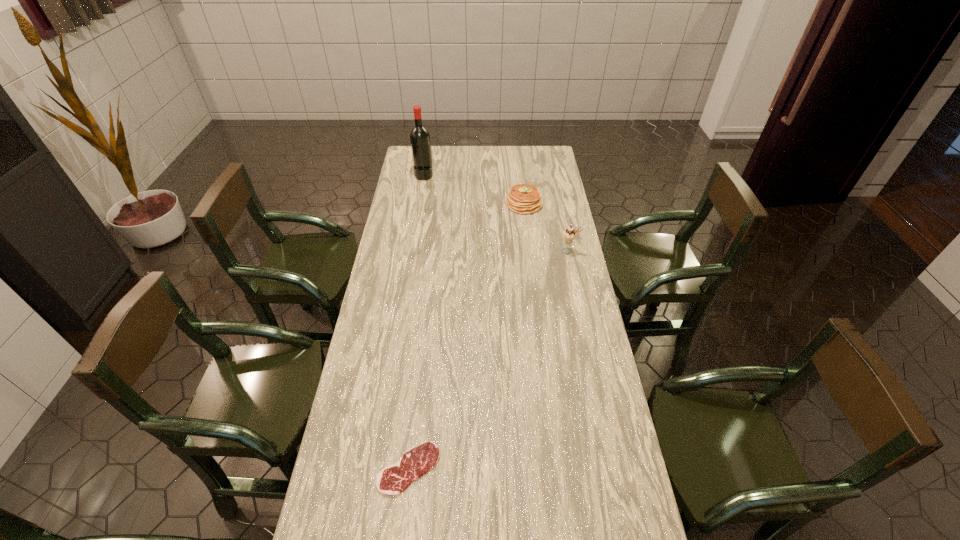
Find the location of a particular element. This screenshot has height=540, width=960. empty location between the steak and the third shortest object is located at coordinates (489, 360).

Find the location of `empty location between the second shortest object and the icecream`. empty location between the second shortest object and the icecream is located at coordinates coord(546,227).

In order to click on object that can be found as the second closest to the third farthest object in this screenshot , I will do `click(420, 140)`.

Point out which object is positioned as the third nearest to the steak. Please provide its 2D coordinates. Your answer should be formatted as a tuple, i.e. [(x, y)], where the tuple contains the x and y coordinates of a point satisfying the conditions above.

[(420, 140)]

Find the location of a particular element. Image resolution: width=960 pixels, height=540 pixels. free space that satisfies the following two spatial constraints: 1. on the front side of the wine bottle; 2. on the right side of the nearest object is located at coordinates (375, 468).